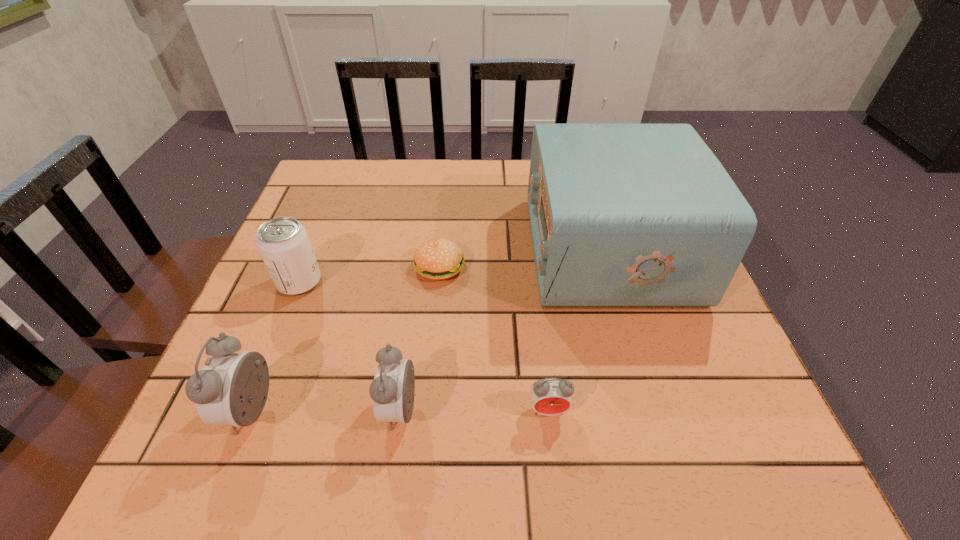
Find the location of a particular element. Image resolution: width=960 pixels, height=540 pixels. free location that satisfies the following two spatial constraints: 1. on the back side of the shortest object; 2. on the left side of the soda can is located at coordinates (306, 267).

The height and width of the screenshot is (540, 960). Find the location of `vacant region that satisfies the following two spatial constraints: 1. on the front panel of the tallest object; 2. on the face of the shortest alarm clock`. vacant region that satisfies the following two spatial constraints: 1. on the front panel of the tallest object; 2. on the face of the shortest alarm clock is located at coordinates (657, 410).

Locate an element on the screen. The image size is (960, 540). vacant space that satisfies the following two spatial constraints: 1. on the face of the shortest alarm clock; 2. on the face of the leftmost alarm clock is located at coordinates (548, 412).

Find the location of a particular element. This screenshot has width=960, height=540. vacant space that satisfies the following two spatial constraints: 1. on the front panel of the radio receiver; 2. on the face of the rightmost alarm clock is located at coordinates (657, 410).

Where is `free space in the image that satisfies the following two spatial constraints: 1. on the face of the shortest alarm clock; 2. on the face of the second tallest alarm clock`? The width and height of the screenshot is (960, 540). free space in the image that satisfies the following two spatial constraints: 1. on the face of the shortest alarm clock; 2. on the face of the second tallest alarm clock is located at coordinates (548, 411).

The width and height of the screenshot is (960, 540). I want to click on vacant space that satisfies the following two spatial constraints: 1. on the back side of the patty; 2. on the right side of the soda can, so click(306, 267).

At what (x,y) coordinates should I click in order to perform the action: click on free location that satisfies the following two spatial constraints: 1. on the face of the shortest alarm clock; 2. on the face of the second tallest alarm clock. Please return your answer as a coordinate pair (x, y). The image size is (960, 540). Looking at the image, I should click on [x=548, y=411].